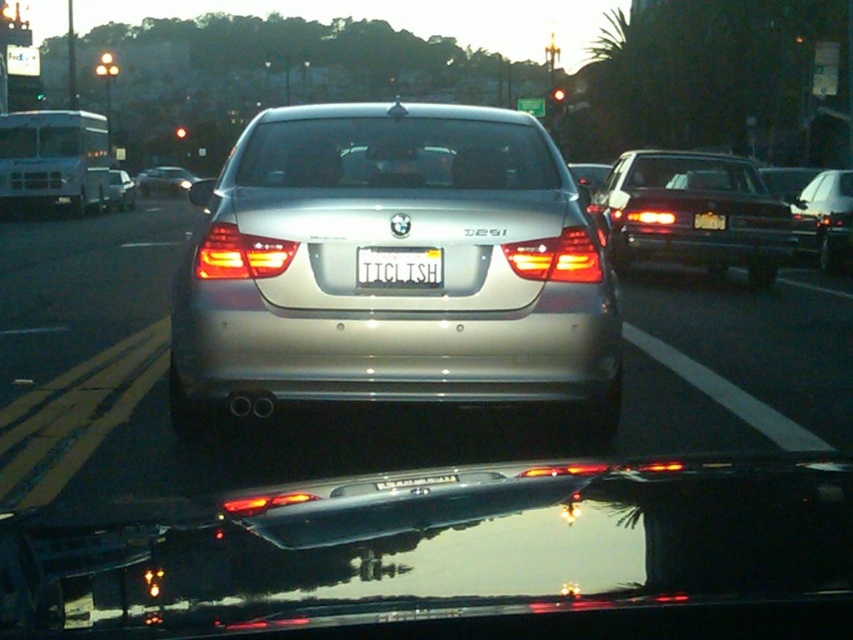
Is point (492, 390) more distant than point (404, 256)?

Yes.

Does satin metallic sedan at center have a larger size compared to white metallic license plate at center?

Indeed, satin metallic sedan at center has a larger size compared to white metallic license plate at center.

Which is behind, point (500, 323) or point (428, 259)?

Positioned behind is point (428, 259).

Find the location of a particular element. satin metallic sedan at center is located at coordinates pos(392,289).

The image size is (853, 640). Describe the element at coordinates (692, 212) in the screenshot. I see `satin black sedan at center` at that location.

Can you confirm if satin black sedan at center is positioned below satin silver sedan at upper left?

Correct, satin black sedan at center is located below satin silver sedan at upper left.

What do you see at coordinates (692, 212) in the screenshot? The height and width of the screenshot is (640, 853). I see `satin black sedan at center` at bounding box center [692, 212].

Identify the location of satin black sedan at center. This screenshot has height=640, width=853. (692, 212).

Can you confirm if satin silver sedan at upper left is wider than satin silver sedan at center?

Yes.

Does point (138, 177) lie behind point (115, 202)?

That is True.

This screenshot has height=640, width=853. Identify the location of satin silver sedan at upper left. 164,180.